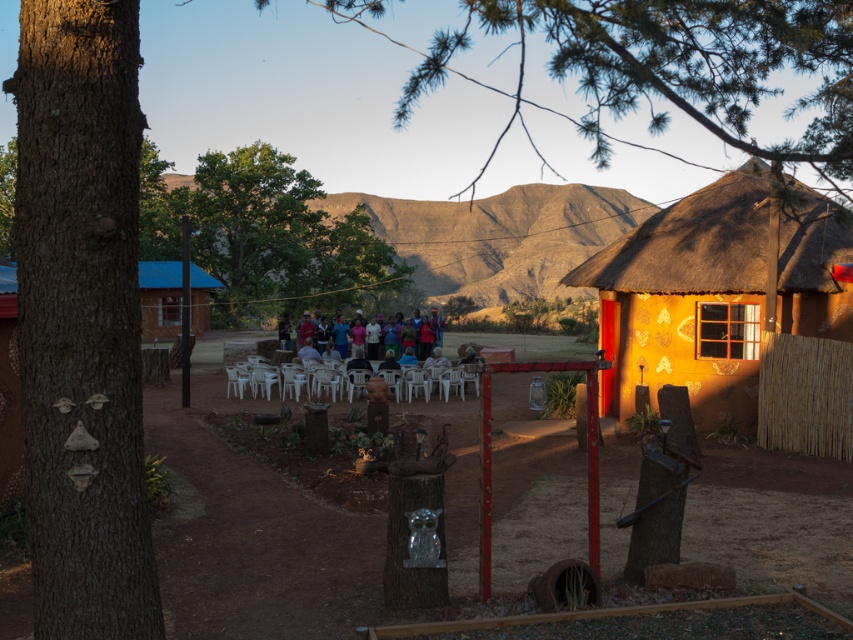
From the picture: Which is more to the right, brown dirt field at center or matte orange thatched hut at right?

matte orange thatched hut at right

Who is shorter, brown dirt field at center or matte orange thatched hut at right?

matte orange thatched hut at right

Is point (692, 545) less distant than point (699, 400)?

Yes, point (692, 545) is closer to viewer.

You are a GUI agent. You are given a task and a screenshot of the screen. Output one action in this format:
    pyautogui.click(x=<x>, y=<y>)
    Task: Click on the brown dirt field at center
    The width and height of the screenshot is (853, 640).
    Given the screenshot: What is the action you would take?
    [x=254, y=538]

Who is positioned more to the left, matte orange thatched hut at right or green rough bark tree at left?

Positioned to the left is green rough bark tree at left.

Is point (621, 385) farther from camera compared to point (10, 157)?

That is False.

The height and width of the screenshot is (640, 853). I want to click on matte orange thatched hut at right, so click(688, 301).

Who is more distant from viewer, [51,131] or [393,323]?

The point [393,323] is behind.

Does brown rough bark tree at left have a lesser width compared to multicolored fabric group at center?

No, brown rough bark tree at left is not thinner than multicolored fabric group at center.

Find the location of a particular element. This screenshot has height=640, width=853. brown rough bark tree at left is located at coordinates (82, 317).

Find the location of a particular element. This screenshot has height=640, width=853. brown rough bark tree at left is located at coordinates (82, 317).